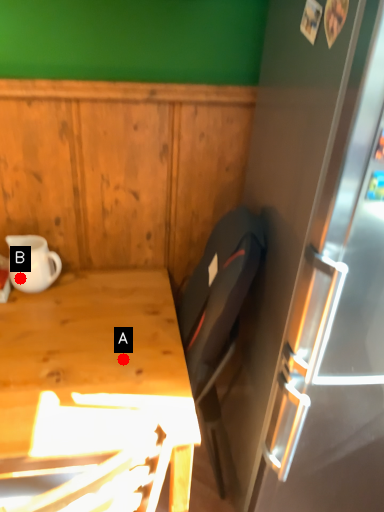
Question: Two points are circled on the image, labeled by A and B beside each circle. Which point is farther to the camera?

Choices:
 (A) A is further
 (B) B is further

Answer: (B)